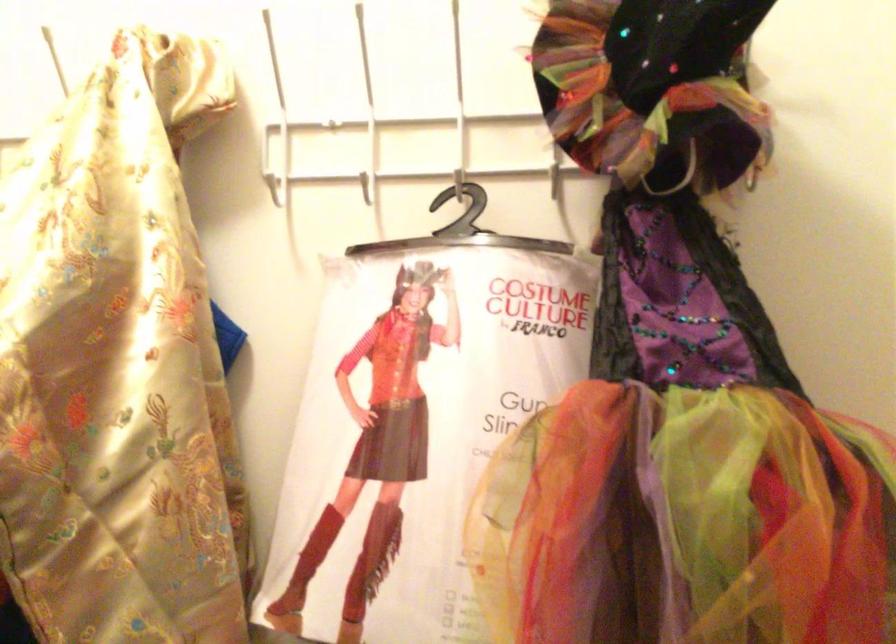
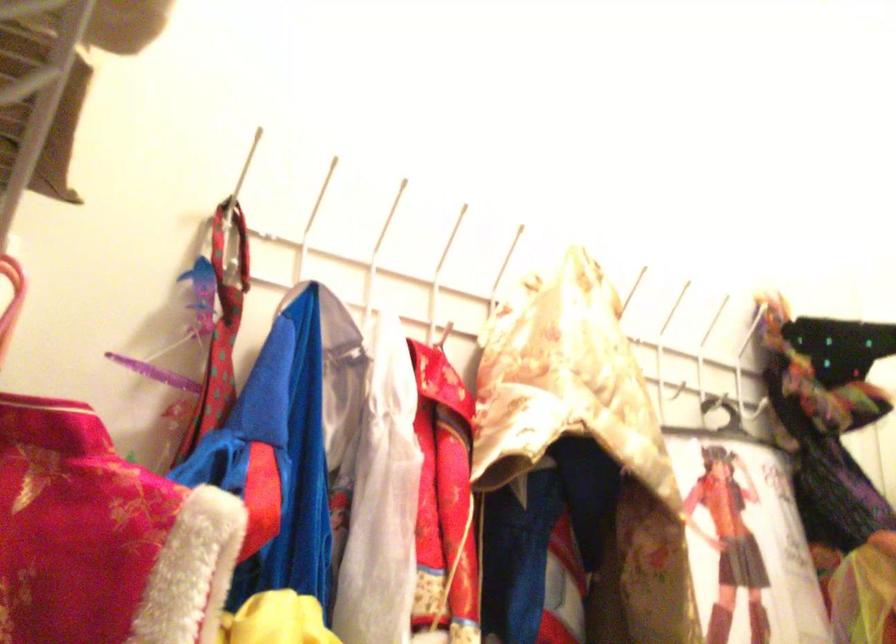
Locate, in the second image, the point that corresponds to pixel 126 90 in the first image.

(505, 261)